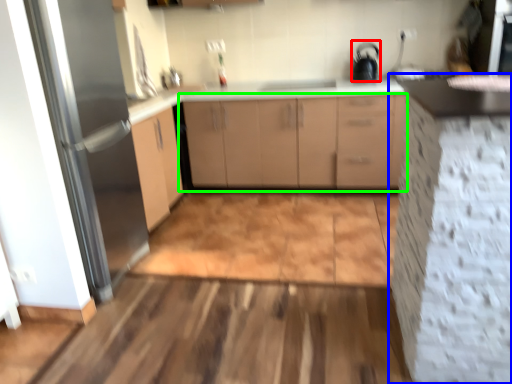
Question: Which is nearer to the appliance (highlighted by a red box)? cabinetry (highlighted by a blue box) or cabinetry (highlighted by a green box).

Choices:
 (A) cabinetry
 (B) cabinetry

Answer: (B)